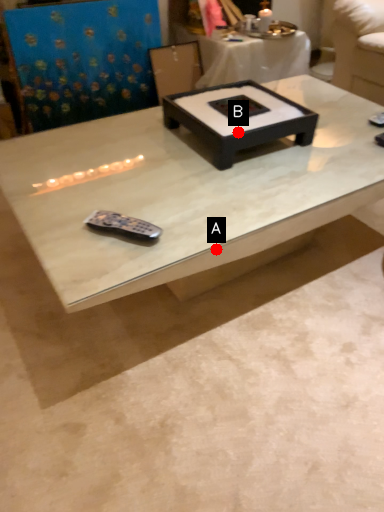
Question: Two points are circled on the image, labeled by A and B beside each circle. Which point is farther from the camera taking this photo?

Choices:
 (A) A is further
 (B) B is further

Answer: (B)